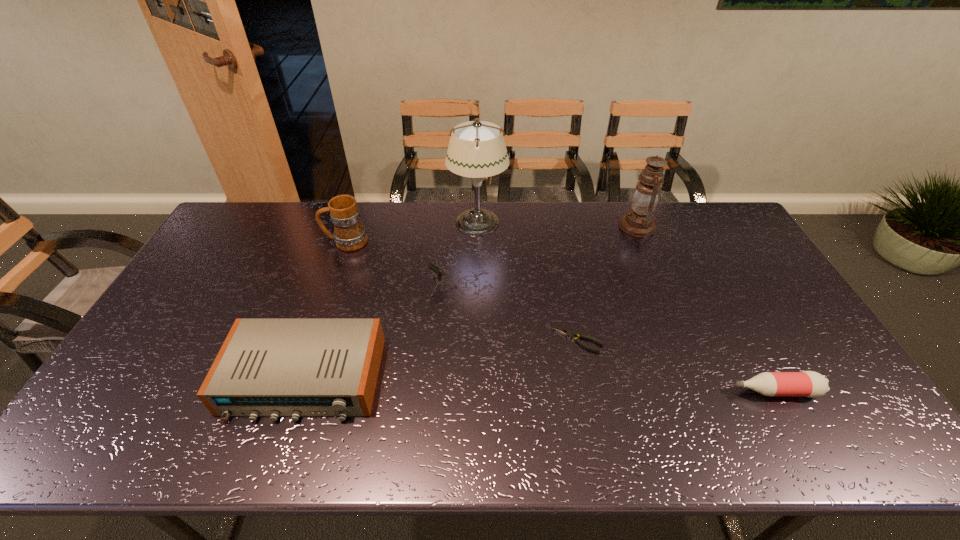
Image resolution: width=960 pixels, height=540 pixels. Find the location of `the tallest object`. the tallest object is located at coordinates (477, 149).

Identify the location of oil lamp. Image resolution: width=960 pixels, height=540 pixels. (638, 222).

Where is `the fifth shortest object`? the fifth shortest object is located at coordinates (349, 234).

Locate an element on the screen. The height and width of the screenshot is (540, 960). microphone is located at coordinates (431, 266).

Where is `radio receiver`? radio receiver is located at coordinates (266, 367).

The image size is (960, 540). What are the coordinates of `bottle` in the screenshot? It's located at (811, 384).

Find the location of a particular element. the fifth object from left to right is located at coordinates (565, 332).

Where is `the shortest object`? the shortest object is located at coordinates (565, 332).

Locate an element on the screen. vacant space located 0.320m on the lampshade of the tallest object is located at coordinates (594, 223).

Find the location of a particular element. free region located on the front of the second tallest object is located at coordinates (653, 265).